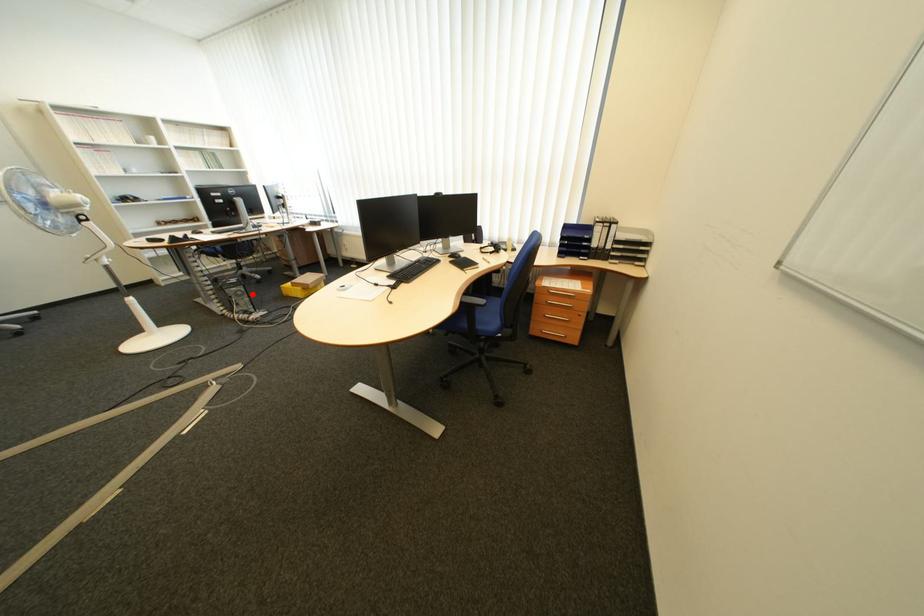
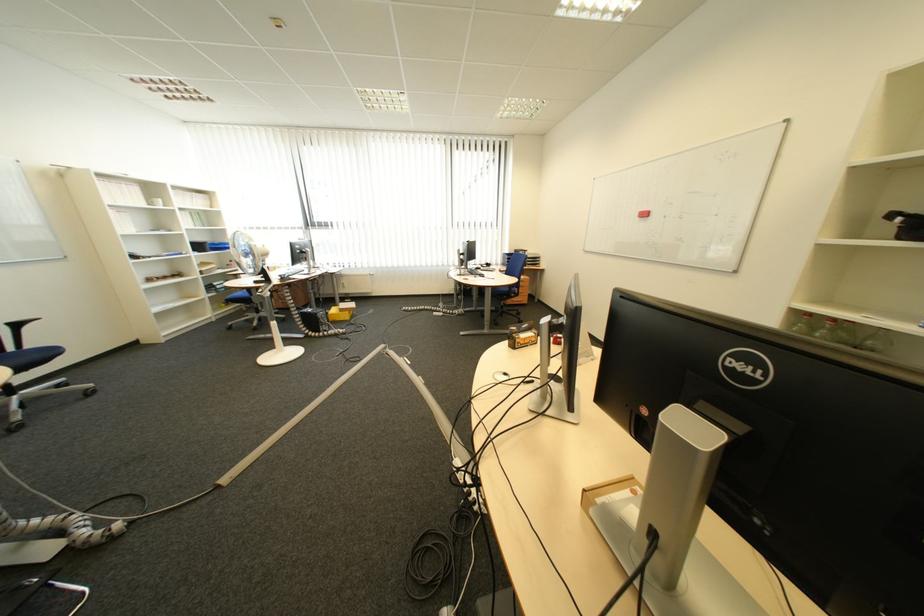
Where in the second image is the point corresponding to the highlighted location from the first image?

(335, 317)